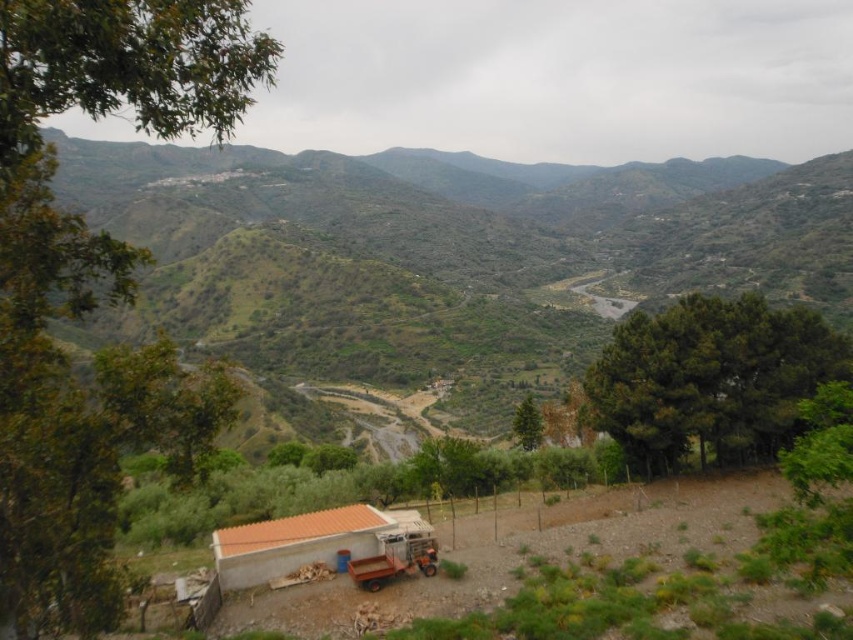
You are a hiker carrying a heavy backpack and need to reach the dirt track to continue your journey. You are currently standing next to the orange tile hut at lower center. Can you estimate how far you need to walk to reach the brown gravel dirt track at lower center?

The distance between the orange tile hut at lower center and the brown gravel dirt track at lower center is 6.65 meters. Therefore, you need to walk approximately 6.65 meters to reach the track.

You are a hiker with a 2.5 meter wide tent. You want to set up your tent on the brown gravel dirt track at lower center or the orange tile hut at lower center. Which location has enough space for your tent?

The brown gravel dirt track at lower center might be wider than orange tile hut at lower center, so it is possible that the dirt track has enough space for the 2.5 meter wide tent. The orange tile hut at lower center is likely narrower and may not accommodate the tent.